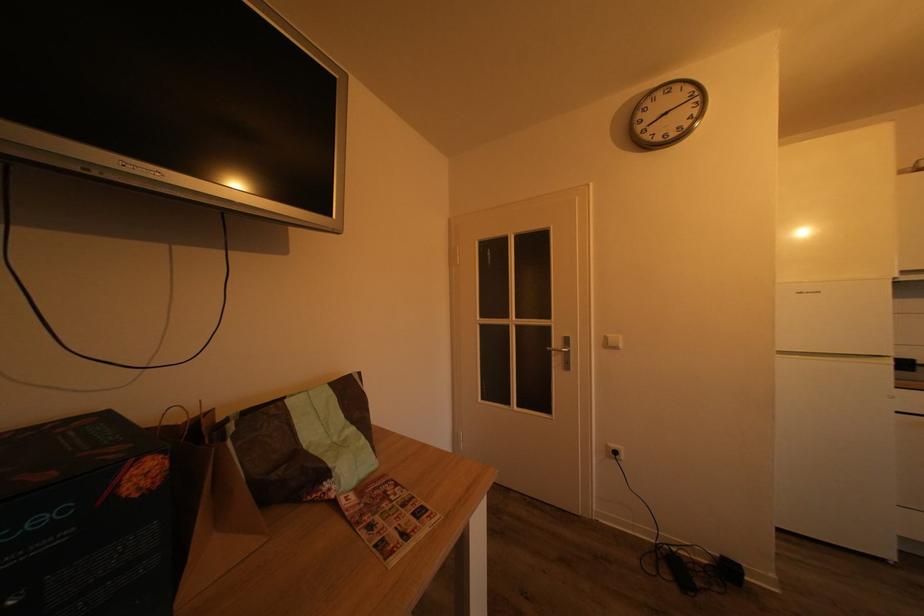
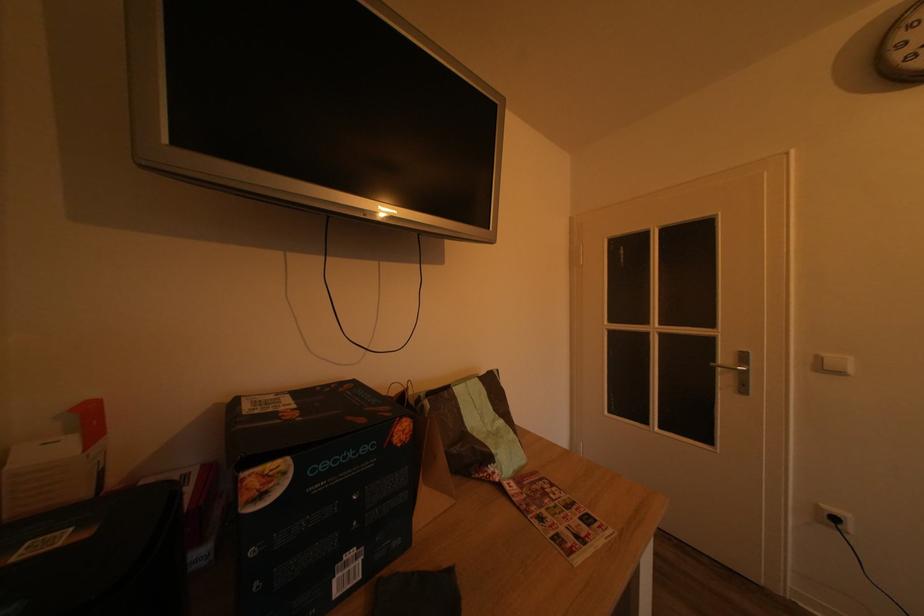
Find the pixel in the second image that matches point 614,345 in the first image.

(825, 365)